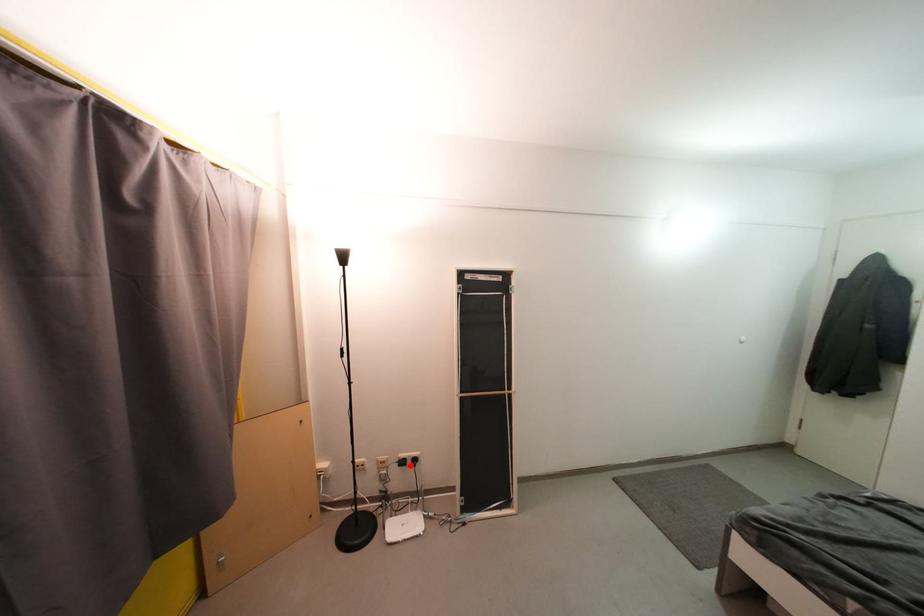
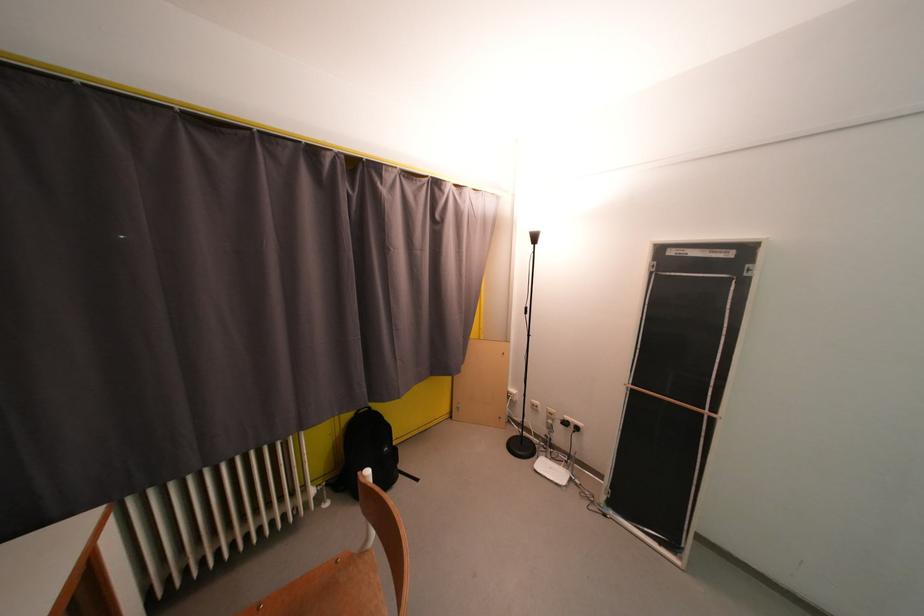
Find the pixel in the second image that matches the highlighted location in the first image.

(573, 427)